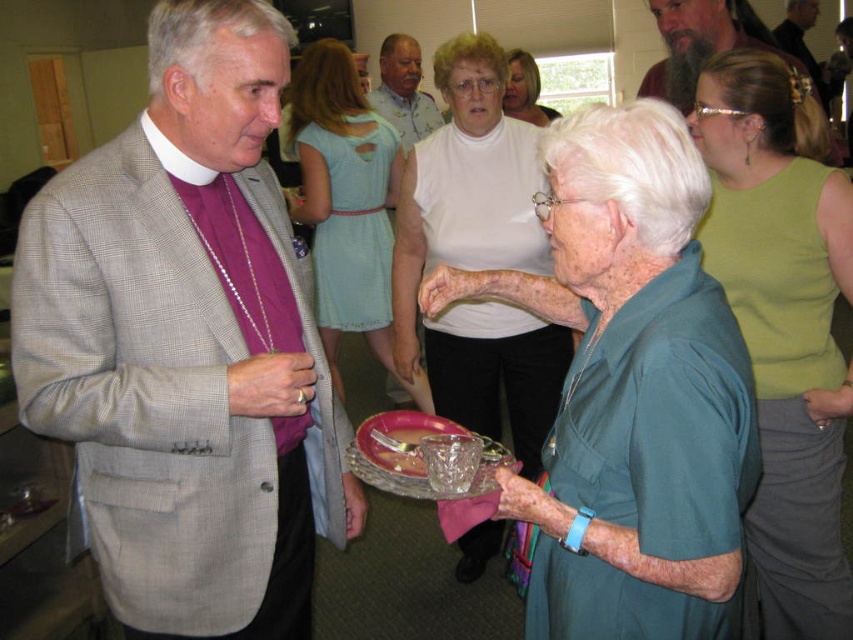
You are organizing a photo album and want to place the green sleeveless top at upper right and the bearded man at upper center in a row. If you arrange them side by side, which one would take up more space?

The green sleeveless top at upper right is bigger than the bearded man at upper center, so it would take up more space when placed side by side.

In the scene shown: You are organizing a photo shoot and need to arrange two outfits based on their widths. You have the teal fabric shirt at center and the green sleeveless top at upper right. According to the image, which outfit should you place on the wider hanger?

The teal fabric shirt at center should be placed on the wider hanger because it is wider than the green sleeveless top at upper right.

You are at a community event and need to locate the bearded man at upper center. Which direction should you look relative to the green sleeveless top at upper right?

The green sleeveless top at upper right is positioned on the left side of bearded man at upper center, so you should look to the right of the green sleeveless top at upper right to find the bearded man at upper center.